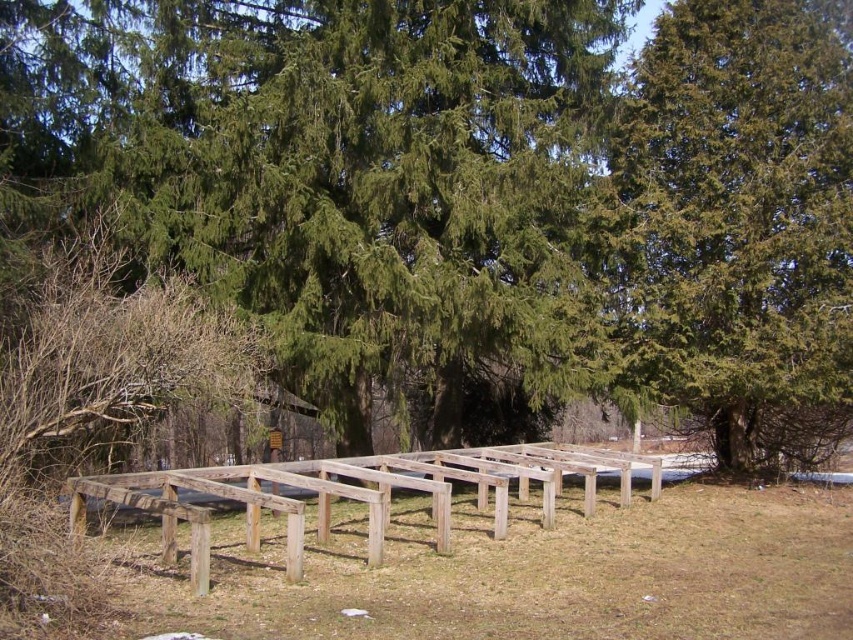
Question: Can you confirm if green textured tree at upper right is positioned below weathered wood frame at center?

Choices:
 (A) no
 (B) yes

Answer: (A)

Question: Which object appears closest to the camera in this image?

Choices:
 (A) weathered wood frame at center
 (B) green textured tree at upper right

Answer: (A)

Question: Which point is closer to the camera taking this photo?

Choices:
 (A) (524, 484)
 (B) (653, 67)

Answer: (A)

Question: Among these objects, which one is farthest from the camera?

Choices:
 (A) green textured tree at upper right
 (B) weathered wood frame at center

Answer: (A)

Question: Does green textured tree at upper right appear over weathered wood frame at center?

Choices:
 (A) yes
 (B) no

Answer: (A)

Question: Is green textured tree at upper right behind weathered wood frame at center?

Choices:
 (A) yes
 (B) no

Answer: (A)